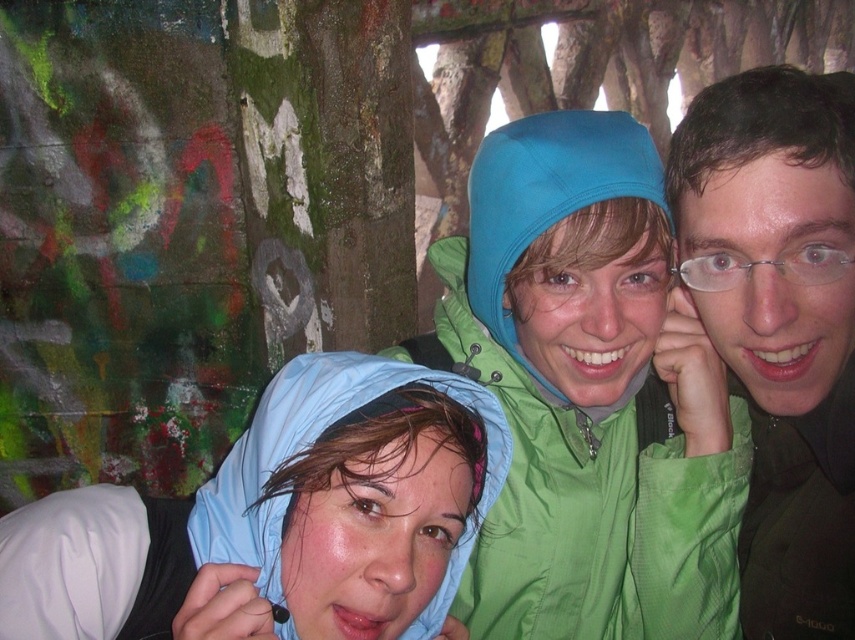
Question: Considering the real-world distances, which object is farthest from the blue fabric hood at lower left?

Choices:
 (A) matte green jacket at upper right
 (B) green matte jacket at center

Answer: (A)

Question: Which object is positioned closest to the blue fabric hood at lower left?

Choices:
 (A) green matte jacket at center
 (B) matte green jacket at upper right

Answer: (A)

Question: Among these objects, which one is nearest to the camera?

Choices:
 (A) matte green jacket at upper right
 (B) blue fabric hood at lower left

Answer: (B)

Question: Is matte green jacket at upper right thinner than green matte jacket at center?

Choices:
 (A) no
 (B) yes

Answer: (B)

Question: Is blue fabric hood at lower left closer to the viewer compared to matte green jacket at upper right?

Choices:
 (A) yes
 (B) no

Answer: (A)

Question: Is blue fabric hood at lower left below green matte jacket at center?

Choices:
 (A) no
 (B) yes

Answer: (B)